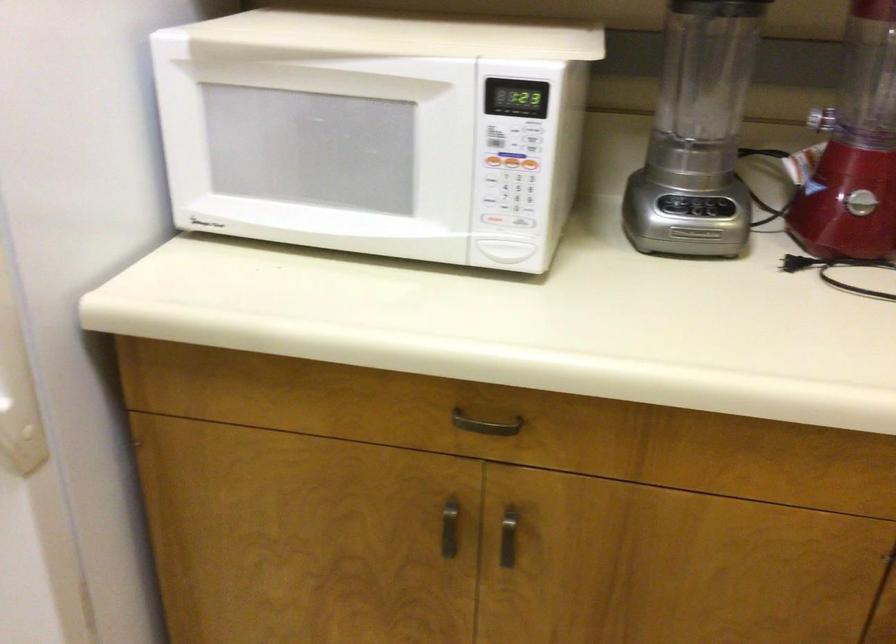
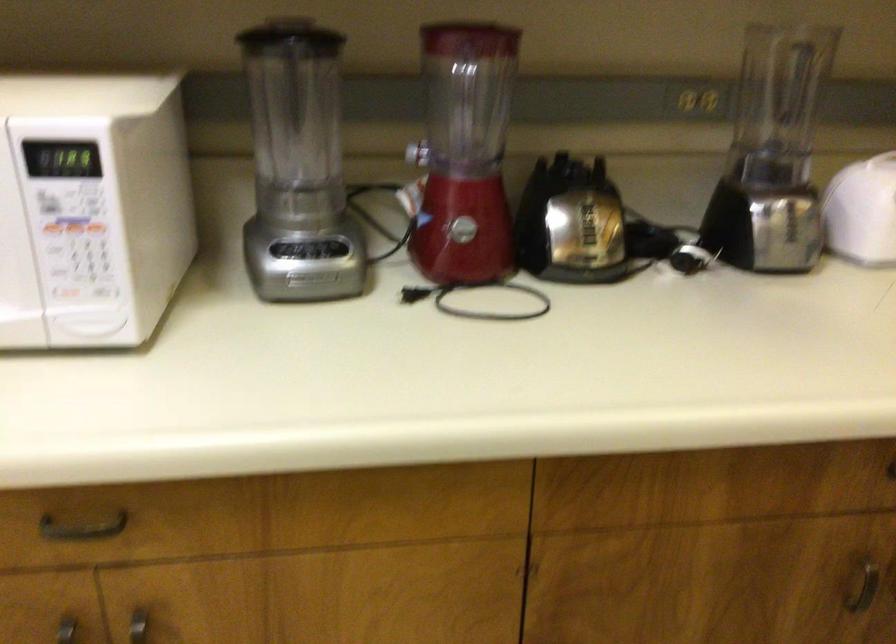
The point at (696, 79) is marked in the first image. Where is the corresponding point in the second image?

(295, 120)